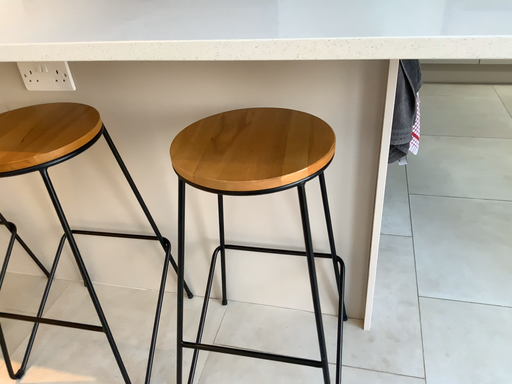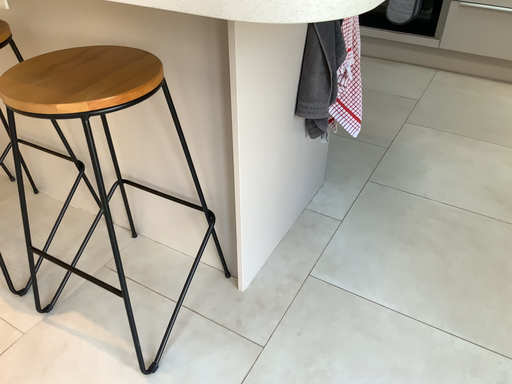
Question: Which way did the camera rotate in the video?

Choices:
 (A) rotated right
 (B) rotated left

Answer: (B)